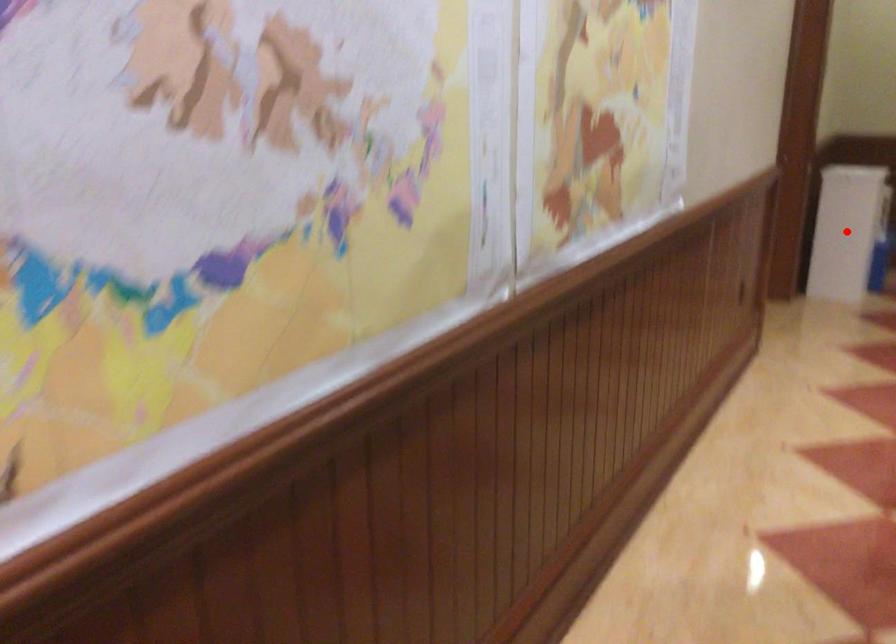
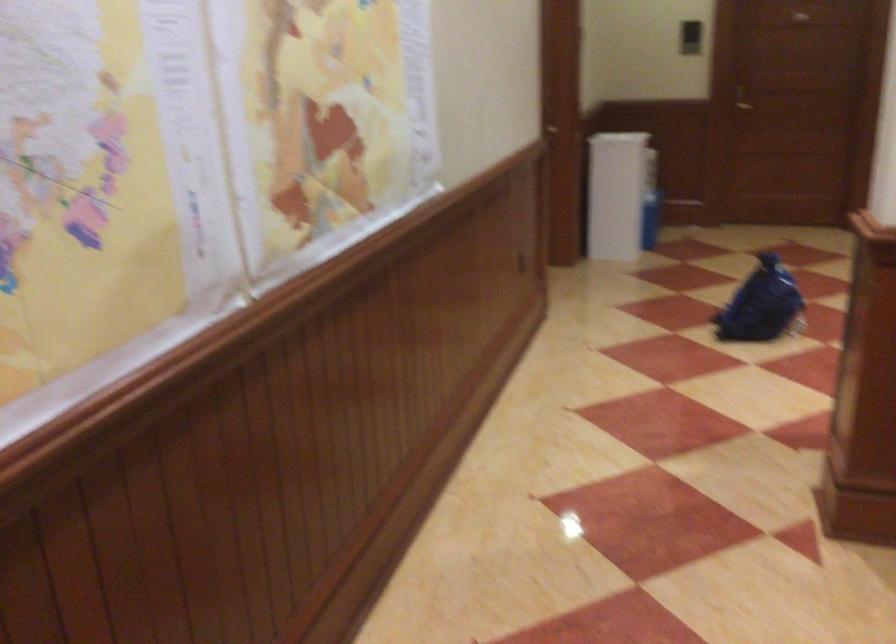
Question: I am providing you with two images of the same scene from different viewpoints. A red point is marked on the first image. At the location where the point appears in image 1, is it still visible in image 2?

Choices:
 (A) Yes
 (B) No

Answer: (A)